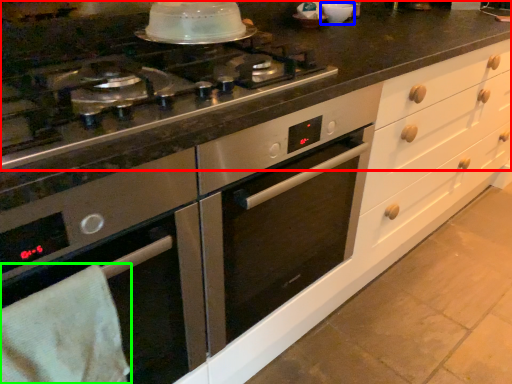
Question: Considering the real-world distances, which object is closest to countertop (highlighted by a red box)? appliance (highlighted by a blue box) or material (highlighted by a green box).

Choices:
 (A) appliance
 (B) material

Answer: (A)